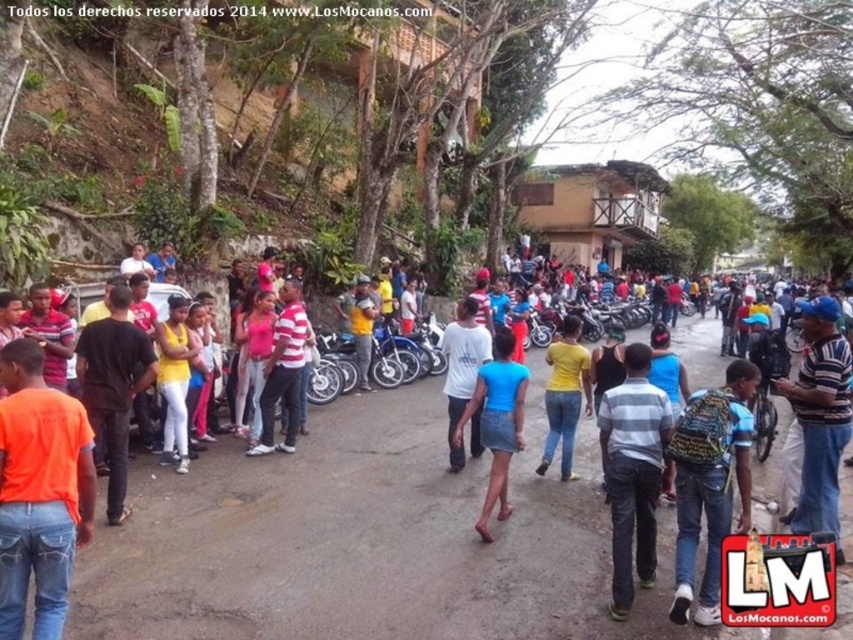
You are a photographer trying to capture a photo of the orange matte shirt at lower left and the gray striped shirt at center in the same frame. Which shirt should you focus on first to ensure both are in the frame without adjusting your camera angle?

The orange matte shirt at lower left is shorter than the gray striped shirt at center. To include both in the frame, focus on the orange matte shirt at lower left first since it is closer to the camera, allowing the taller gray striped shirt at center to naturally fall into the background.

You are a photographer trying to capture a photo of the yellow matte shirt at center without including the orange matte shirt at lower left. Based on their positions, is this possible?

The orange matte shirt at lower left is positioned under the yellow matte shirt at center, so it is likely blocking the view. Therefore, capturing the yellow matte shirt at center without including the orange matte shirt at lower left might not be possible unless adjusting the angle or moving closer.

You are a photographer trying to capture a photo of the yellow matte shirt at center. To ensure the orange matte shirt at lower left is visible in the frame, should you pan your camera to the left or right?

You should pan your camera to the left because the orange matte shirt at lower left is to the left of the yellow matte shirt at center.